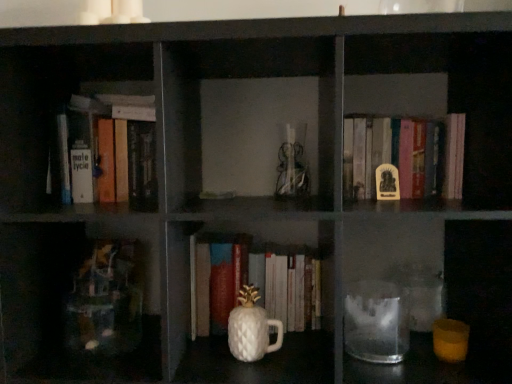
Question: Is white glossy pineapple-shaped cup at center closer to camera compared to yellow matte statue at center, the second book viewed from the left?

Choices:
 (A) no
 (B) yes

Answer: (B)

Question: Is white glossy pineapple-shaped cup at center with yellow matte statue at center, the second book viewed from the left?

Choices:
 (A) yes
 (B) no

Answer: (B)

Question: From the image's perspective, is white glossy pineapple-shaped cup at center on top of yellow matte statue at center, the second book viewed from the left?

Choices:
 (A) yes
 (B) no

Answer: (B)

Question: Considering the relative positions of white glossy pineapple-shaped cup at center and yellow matte statue at center, which is the 1th book from right to left, in the image provided, is white glossy pineapple-shaped cup at center to the right of yellow matte statue at center, which is the 1th book from right to left, from the viewer's perspective?

Choices:
 (A) no
 (B) yes

Answer: (A)

Question: Considering the relative sizes of white glossy pineapple-shaped cup at center and yellow matte statue at center, the second book viewed from the left, in the image provided, is white glossy pineapple-shaped cup at center bigger than yellow matte statue at center, the second book viewed from the left,?

Choices:
 (A) yes
 (B) no

Answer: (B)

Question: Are white glossy pineapple-shaped cup at center and yellow matte statue at center, the second book viewed from the left, far apart?

Choices:
 (A) yes
 (B) no

Answer: (B)

Question: Does hardcover book at upper left, which is the first book in left-to-right order, contain transparent glass jar at lower center?

Choices:
 (A) no
 (B) yes

Answer: (A)

Question: Is hardcover book at upper left, which is the first book in left-to-right order, wider than transparent glass jar at lower center?

Choices:
 (A) no
 (B) yes

Answer: (B)

Question: Is hardcover book at upper left, which is the first book in left-to-right order, not within transparent glass jar at lower center?

Choices:
 (A) no
 (B) yes

Answer: (B)

Question: Is hardcover book at upper left, which is the first book in left-to-right order, touching transparent glass jar at lower center?

Choices:
 (A) yes
 (B) no

Answer: (B)

Question: Is hardcover book at upper left, which is the first book in left-to-right order, oriented towards transparent glass jar at lower center?

Choices:
 (A) yes
 (B) no

Answer: (B)

Question: Is hardcover book at upper left, arranged as the second book when viewed from the right, smaller than transparent glass jar at lower center?

Choices:
 (A) yes
 (B) no

Answer: (B)

Question: Is white glossy pineapple-shaped cup at center positioned in front of hardcover book at upper left, arranged as the second book when viewed from the right?

Choices:
 (A) no
 (B) yes

Answer: (B)